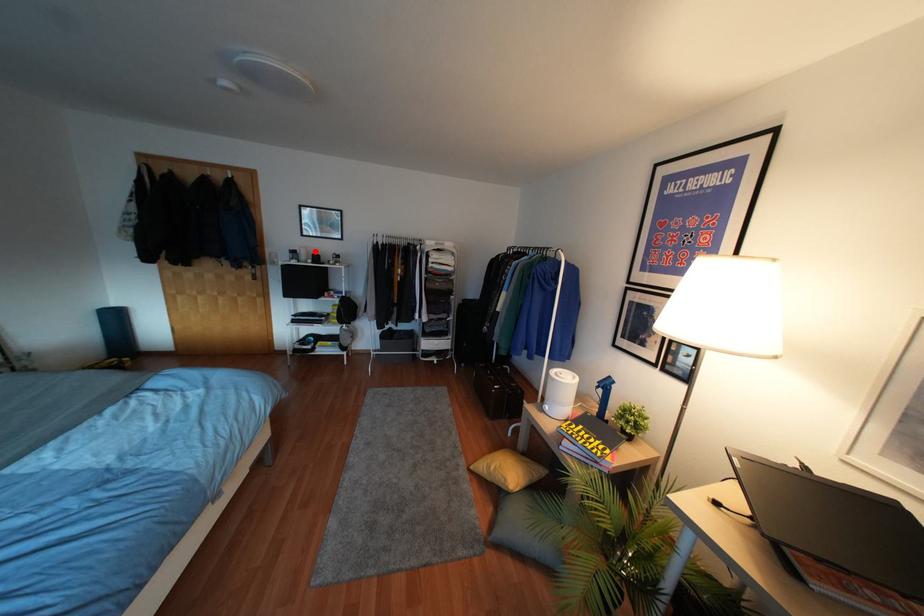
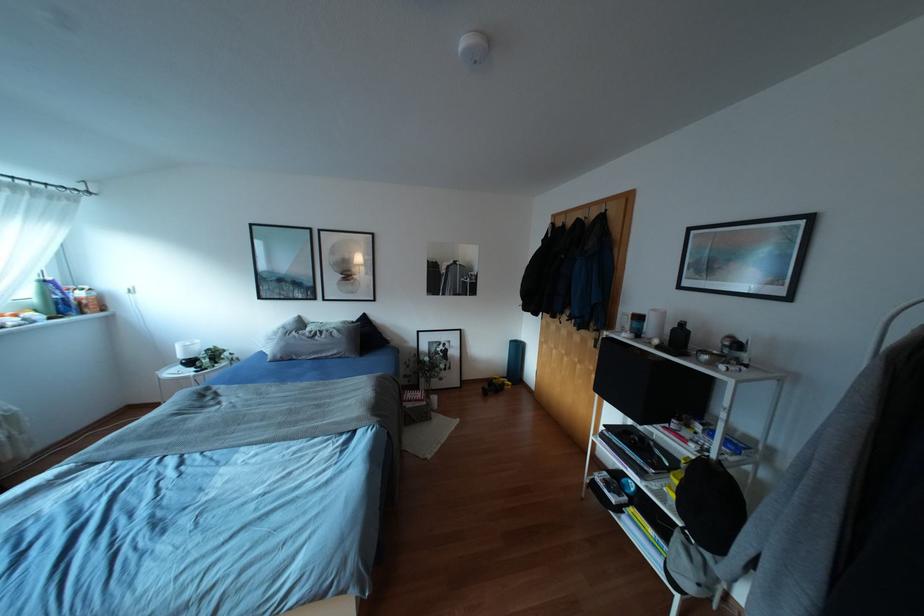
Question: I am providing you with two images of the same scene from different viewpoints. A red point is marked on the first image. Is the red point's position out of view in image 2?

Choices:
 (A) Yes
 (B) No

Answer: (B)